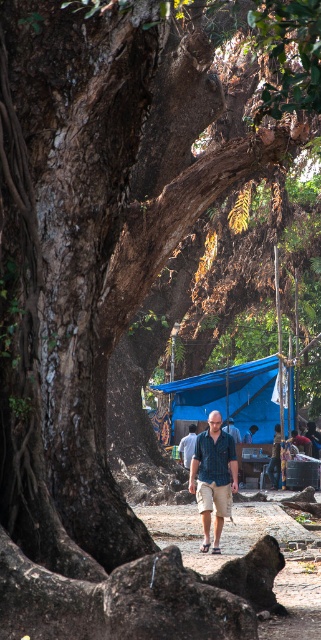
Between point (159, 520) and point (185, 467), which one is positioned behind?

The point (185, 467) is more distant.

Consider the image. Which is more to the left, dirt path at center or blue fabric at center?

From the viewer's perspective, blue fabric at center appears more on the left side.

Who is more forward, (257,540) or (182,452)?

Point (257,540)

Find the location of a particular element. The image size is (321, 640). dirt path at center is located at coordinates (246, 552).

Who is taller, blue tarpaulin at center or blue fabric at center?

Standing taller between the two is blue fabric at center.

Which is in front, point (269, 424) or point (189, 449)?

Point (189, 449) is more forward.

Between point (285, 387) and point (189, 458), which one is positioned behind?

Positioned behind is point (189, 458).

The width and height of the screenshot is (321, 640). Identify the location of blue tarpaulin at center. (231, 396).

Based on the photo, does blue textured shirt at center have a smaller size compared to blue fabric at center?

No.

Does blue textured shirt at center come behind blue fabric at center?

No, it is not.

Identify the location of blue textured shirt at center. The image size is (321, 640). (214, 477).